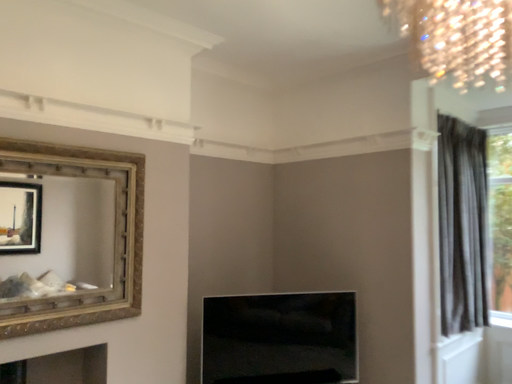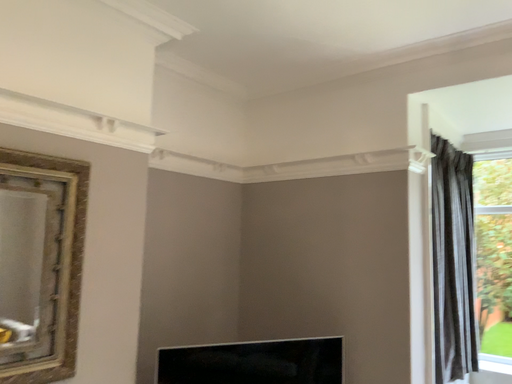
Question: How did the camera likely rotate when shooting the video?

Choices:
 (A) rotated left
 (B) rotated right

Answer: (B)